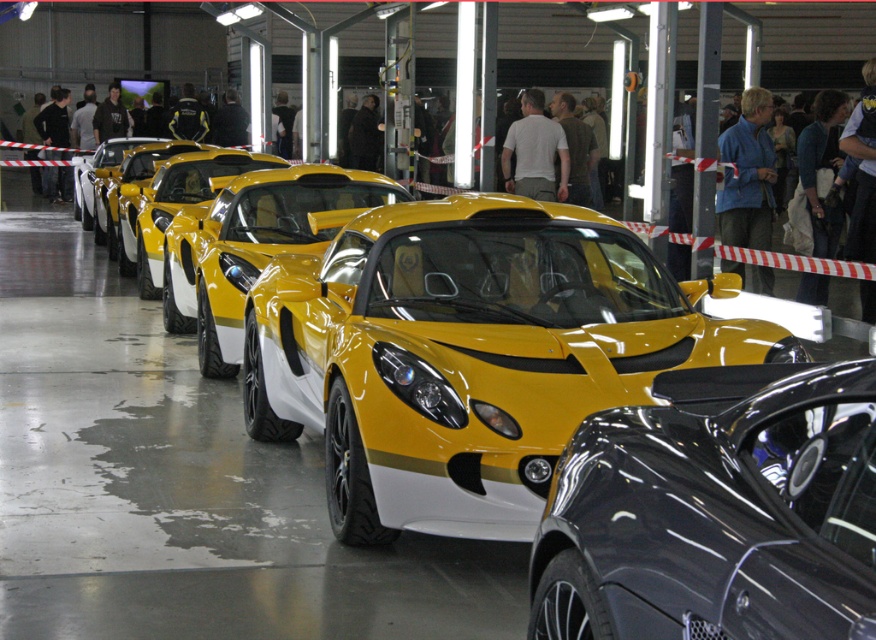
Question: Can you confirm if yellow matte sports car at center is smaller than glossy black car at center?

Choices:
 (A) yes
 (B) no

Answer: (B)

Question: Considering the real-world distances, which object is closest to the glossy black car at center?

Choices:
 (A) yellow glossy sports car at center
 (B) yellow matte sports car at center

Answer: (B)

Question: Among these objects, which one is farthest from the camera?

Choices:
 (A) yellow glossy sports car at center
 (B) glossy black car at center

Answer: (A)

Question: Does yellow matte sports car at center appear under yellow glossy sports car at center?

Choices:
 (A) no
 (B) yes

Answer: (B)

Question: Is glossy black car at center smaller than yellow glossy sports car at center?

Choices:
 (A) yes
 (B) no

Answer: (A)

Question: Which object appears farthest from the camera in this image?

Choices:
 (A) glossy black car at center
 (B) yellow glossy sports car at center
 (C) yellow matte sports car at center

Answer: (B)